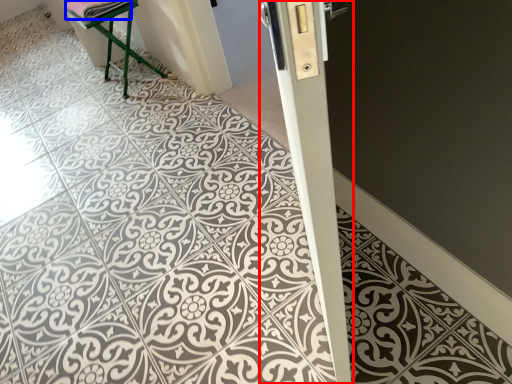
Question: Among these objects, which one is nearest to the camera, pillar (highlighted by a red box) or material (highlighted by a blue box)?

Choices:
 (A) pillar
 (B) material

Answer: (A)